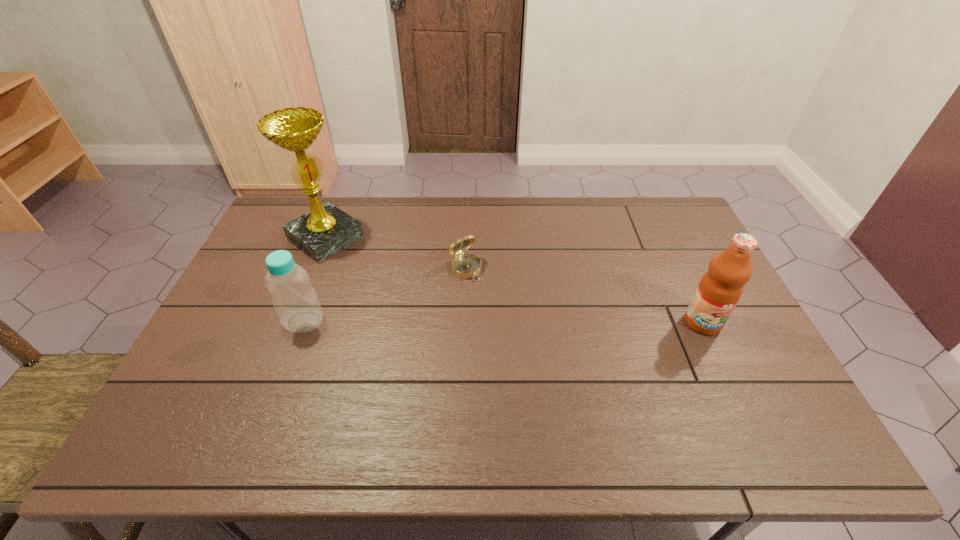
Locate an element on the screen. The height and width of the screenshot is (540, 960). free space at the right edge of the desktop is located at coordinates (754, 352).

I want to click on free spot at the far left corner of the desktop, so click(298, 199).

I want to click on free location at the far right corner of the desktop, so click(x=646, y=213).

The height and width of the screenshot is (540, 960). I want to click on vacant space at the near right corner of the desktop, so click(x=734, y=407).

Locate an element on the screen. This screenshot has height=540, width=960. blank region between the compass and the fruit juice is located at coordinates (584, 295).

Find the location of a particular element. The height and width of the screenshot is (540, 960). free space between the award and the bottle is located at coordinates (315, 280).

Where is `free space between the second shortest object and the third shortest object`? This screenshot has height=540, width=960. free space between the second shortest object and the third shortest object is located at coordinates (503, 322).

You are a GUI agent. You are given a task and a screenshot of the screen. Output one action in this format:
    pyautogui.click(x=<x>, y=<y>)
    Task: Click on the vacant space that is in between the third tallest object and the tallest object
    
    Given the screenshot: What is the action you would take?
    pyautogui.click(x=315, y=280)

This screenshot has height=540, width=960. I want to click on vacant point located between the rightmost object and the second shortest object, so click(x=503, y=322).

Where is `free area in between the rightmost object and the shortest object`? The width and height of the screenshot is (960, 540). free area in between the rightmost object and the shortest object is located at coordinates (584, 295).